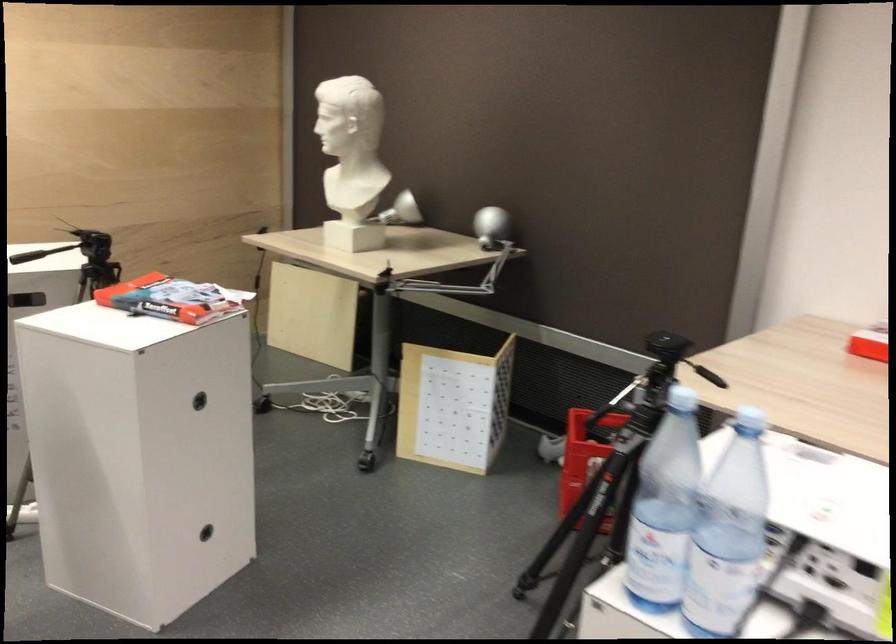
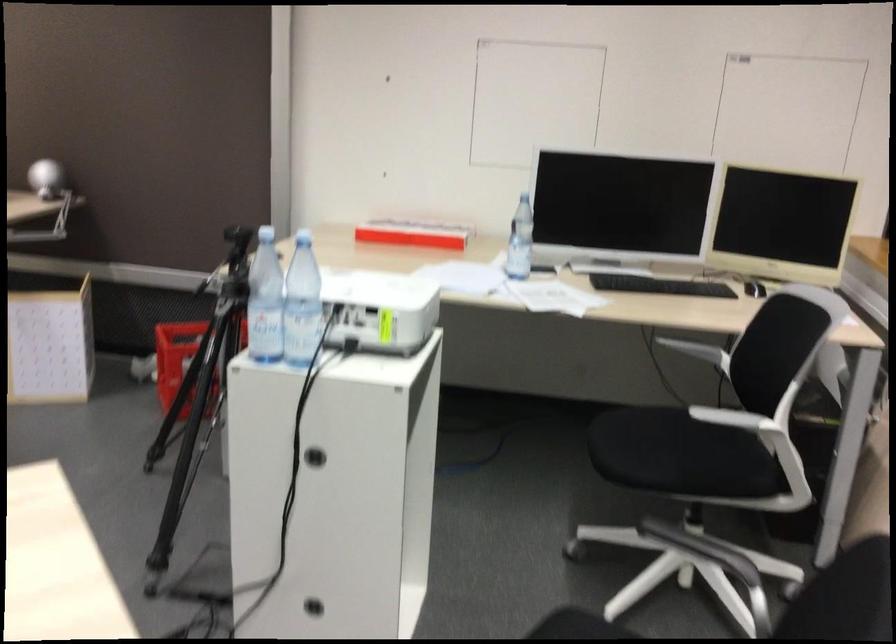
The point at (762, 518) is marked in the first image. Where is the corresponding point in the second image?

(302, 303)